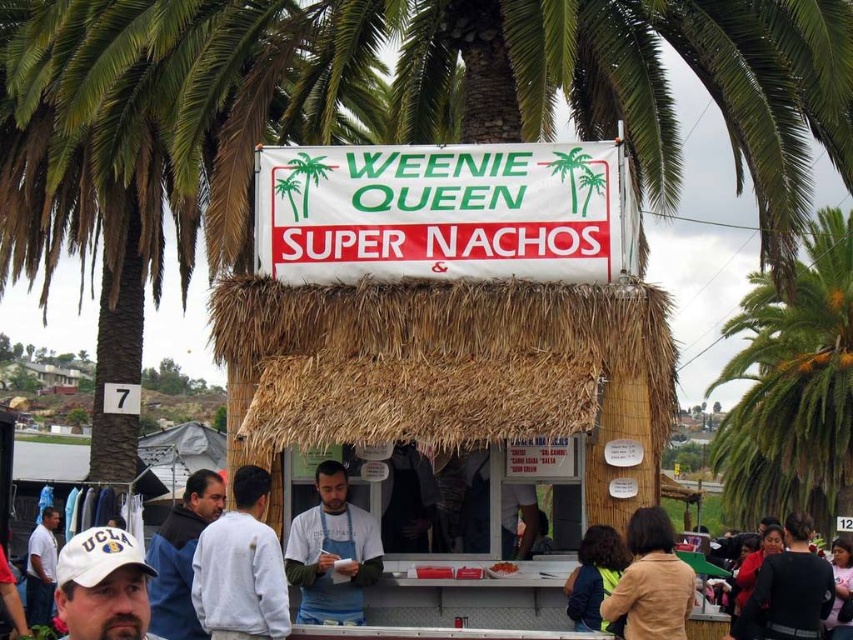
You are a customer at the food stall and want to take a photo of the orange matte nachos at center. The green leafy palm tree at upper center is blocking your view. Can you estimate whether the palm tree is bigger or smaller than the nachos?

The green leafy palm tree at upper center has a larger size compared to orange matte nachos at center, so the palm tree is bigger and might be blocking the view.

You are a customer at the WEENIE QUEEN SUPER NACHOS stall. You notice two points marked on the ground near the counter. One is at point (772, 497) and the other at point (502, 561). If you are facing the counter, which point is closer to the back of the stall?

Result: Point (772, 497) is behind point (502, 561). Therefore, if you are facing the counter, point (772, 497) is closer to the back of the stall.